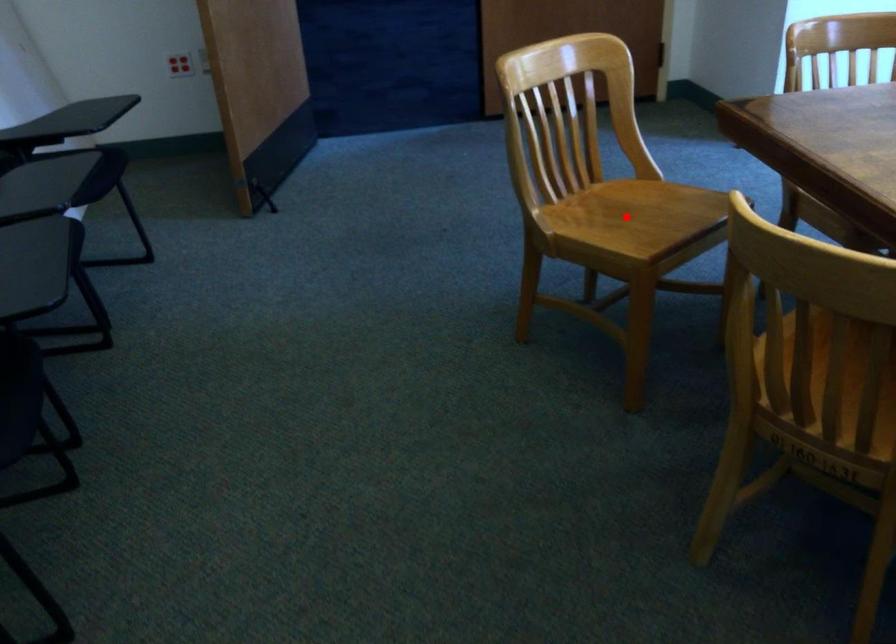
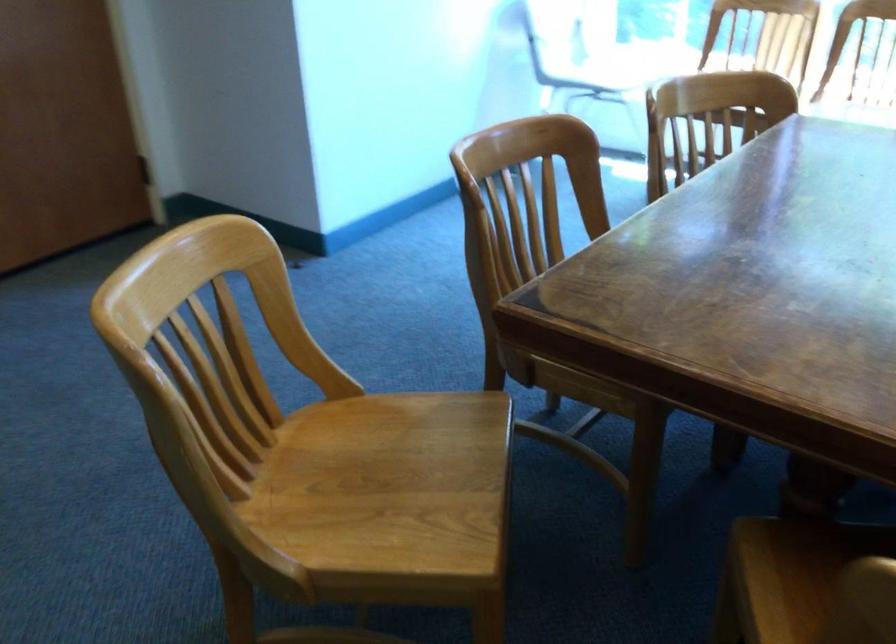
Question: I am providing you with two images of the same scene from different viewpoints. Given a red point in image1, look at the same physical point in image2. Is it:

Choices:
 (A) Closer to the viewpoint
 (B) Farther from the viewpoint

Answer: (A)